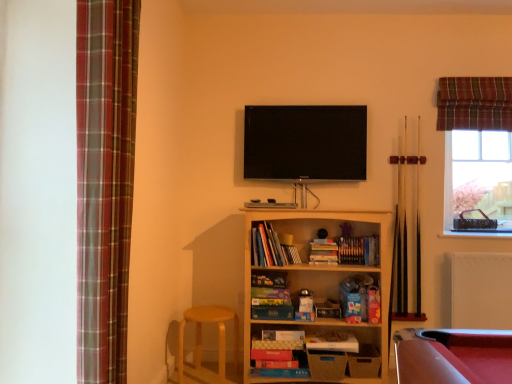
What is the approximate height of light brown wood stool at lower left?

It is 42.11 centimeters.

What do you see at coordinates (201, 343) in the screenshot? This screenshot has width=512, height=384. I see `light brown wood stool at lower left` at bounding box center [201, 343].

Measure the distance between point (456,307) and camera.

Point (456,307) and camera are 2.97 meters apart from each other.

What do you see at coordinates (402, 232) in the screenshot? The height and width of the screenshot is (384, 512). I see `brown wooden pool cue at right, marked as the first cue in a left-to-right arrangement` at bounding box center [402, 232].

How much space does matte cardboard book at center, which is counted as the first book, starting from the bottom, occupy horizontally?

It is 10.33 inches.

Where is `flat screen tv at upper center`? flat screen tv at upper center is located at coordinates (305, 142).

Locate an element on the screen. The image size is (512, 384). wooden bookshelf at center is located at coordinates (321, 281).

Consider the image. What's the angular difference between hardcover books at center, which ranks as the second book in top-to-bottom order, and plaid fabric curtain at upper right, which is the 1th curtain from right to left,'s facing directions?

The angular difference between hardcover books at center, which ranks as the second book in top-to-bottom order, and plaid fabric curtain at upper right, which is the 1th curtain from right to left, is 2.4 degrees.

Which object is closer to the camera, hardcover books at center, which ranks as the second book in top-to-bottom order, or plaid fabric curtain at upper right, which is the 1th curtain from right to left?

hardcover books at center, which ranks as the second book in top-to-bottom order.

Is hardcover books at center, placed as the second book when sorted from left to right, thinner than plaid fabric curtain at upper right, the first curtain viewed from the back?

Incorrect, the width of hardcover books at center, placed as the second book when sorted from left to right, is not less than that of plaid fabric curtain at upper right, the first curtain viewed from the back.

Based on the photo, could you tell me if hardcover books at center, marked as the second book in a bottom-to-top arrangement, is facing plaid fabric curtain at upper right, which is the 1th curtain from right to left?

No, hardcover books at center, marked as the second book in a bottom-to-top arrangement, is not oriented towards plaid fabric curtain at upper right, which is the 1th curtain from right to left.

Considering the points (123, 232) and (321, 156), which point is in front, point (123, 232) or point (321, 156)?

Point (123, 232)

Based on the photo, considering the sizes of objects plaid fabric curtain at left, the first curtain in the left-to-right sequence, and flat screen tv at upper center in the image provided, who is thinner, plaid fabric curtain at left, the first curtain in the left-to-right sequence, or flat screen tv at upper center?

Thinner between the two is flat screen tv at upper center.

What's the angular difference between plaid fabric curtain at left, the first curtain in the left-to-right sequence, and flat screen tv at upper center's facing directions?

The facing directions of plaid fabric curtain at left, the first curtain in the left-to-right sequence, and flat screen tv at upper center are 87.7 degrees apart.

Considering the sizes of objects plaid fabric curtain at left, the first curtain in the left-to-right sequence, and flat screen tv at upper center in the image provided, who is smaller, plaid fabric curtain at left, the first curtain in the left-to-right sequence, or flat screen tv at upper center?

With smaller size is flat screen tv at upper center.

Do you think clear glass window at upper right is within white matte radiator at lower right, or outside of it?

clear glass window at upper right cannot be found inside white matte radiator at lower right.

Is clear glass window at upper right taller than white matte radiator at lower right?

Yes, clear glass window at upper right is taller than white matte radiator at lower right.

Can you tell me how much clear glass window at upper right and white matte radiator at lower right differ in facing direction?

The angular difference between clear glass window at upper right and white matte radiator at lower right is 0.622 degrees.

Between clear glass window at upper right and white matte radiator at lower right, which one has smaller width?

With smaller width is clear glass window at upper right.

From the image's perspective, is wooden bookshelf at center under plaid fabric curtain at upper right, the 2th curtain in the left-to-right sequence?

Yes, from the image's perspective, wooden bookshelf at center is below plaid fabric curtain at upper right, the 2th curtain in the left-to-right sequence.

From a real-world perspective, which curtain is the 2nd one above the wooden bookshelf at center? Please provide its 2D coordinates.

[(474, 103)]

From a real-world perspective, which is physically above, wooden bookshelf at center or plaid fabric curtain at upper right, the 2th curtain in the left-to-right sequence?

plaid fabric curtain at upper right, the 2th curtain in the left-to-right sequence, is physically above.

Between point (384, 227) and point (503, 94), which one is positioned in front?

Positioned in front is point (384, 227).

Can you confirm if wooden pool cue at right, placed as the 1th cue when sorted from right to left, is bigger than brown wooden pool cue at right, marked as the first cue in a left-to-right arrangement?

Indeed, wooden pool cue at right, placed as the 1th cue when sorted from right to left, has a larger size compared to brown wooden pool cue at right, marked as the first cue in a left-to-right arrangement.

From a real-world perspective, is wooden pool cue at right, placed as the 1th cue when sorted from right to left, below brown wooden pool cue at right, marked as the first cue in a left-to-right arrangement?

Yes, from a real-world perspective, wooden pool cue at right, placed as the 1th cue when sorted from right to left, is below brown wooden pool cue at right, marked as the first cue in a left-to-right arrangement.

Is wooden pool cue at right, which is counted as the 2th cue, starting from the left, surrounding brown wooden pool cue at right, marked as the first cue in a left-to-right arrangement?

Definitely not — brown wooden pool cue at right, marked as the first cue in a left-to-right arrangement, is not inside wooden pool cue at right, which is counted as the 2th cue, starting from the left.

Is wooden pool cue at right, placed as the 1th cue when sorted from right to left, touching brown wooden pool cue at right, marked as the first cue in a left-to-right arrangement?

No.

Is plaid fabric curtain at upper right, the first curtain viewed from the back, facing towards clear glass window at upper right?

No, plaid fabric curtain at upper right, the first curtain viewed from the back, is not aimed at clear glass window at upper right.

From a real-world perspective, who is located higher, plaid fabric curtain at upper right, which is the 1th curtain from right to left, or clear glass window at upper right?

From a 3D spatial view, plaid fabric curtain at upper right, which is the 1th curtain from right to left, is above.

From the picture: How many degrees apart are the facing directions of plaid fabric curtain at upper right, the 2th curtain in the left-to-right sequence, and clear glass window at upper right?

There is a 0.708-degree angle between the facing directions of plaid fabric curtain at upper right, the 2th curtain in the left-to-right sequence, and clear glass window at upper right.

From the picture: Is there a large distance between plaid fabric curtain at upper right, the 2th curtain in the left-to-right sequence, and clear glass window at upper right?

No.

Identify the location of book that is the 1st object located above the wooden bookshelf at center (from the image's perspective). This screenshot has height=384, width=512. (323, 252).

Would you consider hardcover books at center, which appears as the second book when viewed from the right, to be distant from wooden bookshelf at center?

hardcover books at center, which appears as the second book when viewed from the right, is actually quite close to wooden bookshelf at center.

From the picture: How distant is hardcover books at center, marked as the second book in a bottom-to-top arrangement, from wooden bookshelf at center?

hardcover books at center, marked as the second book in a bottom-to-top arrangement, is 12.50 inches from wooden bookshelf at center.

Consider the image. Considering the sizes of objects hardcover books at center, which ranks as the second book in top-to-bottom order, and wooden bookshelf at center in the image provided, who is taller, hardcover books at center, which ranks as the second book in top-to-bottom order, or wooden bookshelf at center?

wooden bookshelf at center.

Locate an element on the screen. This screenshot has height=384, width=512. curtain on the right of hardcover books at center, placed as the second book when sorted from left to right is located at coordinates (474, 103).

Locate an element on the screen. curtain that appears on the left of flat screen tv at upper center is located at coordinates (105, 182).

Looking at the image, which one is located closer to brown wooden pool cue at right, arranged as the second cue when viewed from the right, hardcover books at center, the first book positioned from the top, or matte cardboard book at center, which is counted as the first book, starting from the bottom?

Among the two, matte cardboard book at center, which is counted as the first book, starting from the bottom, is located nearer to brown wooden pool cue at right, arranged as the second cue when viewed from the right.

Which object lies nearer to the anchor point light brown wood stool at lower left, wooden pool cue at right, which is counted as the 2th cue, starting from the left, or hardcover books at center, which ranks as the third book in bottom-to-top order?

Among the two, hardcover books at center, which ranks as the third book in bottom-to-top order, is located nearer to light brown wood stool at lower left.

Which object lies further to the anchor point hardcover books at center, marked as the 1th book in a left-to-right arrangement, white matte radiator at lower right or light brown wood stool at lower left?

The object further to hardcover books at center, marked as the 1th book in a left-to-right arrangement, is white matte radiator at lower right.

Considering their positions, is wooden bookshelf at center positioned closer to matte cardboard book at center, the third book when ordered from left to right, than light brown wood stool at lower left?

wooden bookshelf at center.

Which object lies nearer to the anchor point wooden pool cue at right, placed as the 1th cue when sorted from right to left, flat screen tv at upper center or white matte radiator at lower right?

The object closer to wooden pool cue at right, placed as the 1th cue when sorted from right to left, is white matte radiator at lower right.

When comparing their distances from wooden bookshelf at center, does hardcover books at center, marked as the 1th book in a left-to-right arrangement, or plaid fabric curtain at left, the second curtain viewed from the back, seem closer?

hardcover books at center, marked as the 1th book in a left-to-right arrangement, is positioned closer to the anchor wooden bookshelf at center.

When comparing their distances from flat screen tv at upper center, does light brown wood stool at lower left or hardcover books at center, placed as the second book when sorted from left to right, seem further?

The object further to flat screen tv at upper center is light brown wood stool at lower left.

Which object lies further to the anchor point clear glass window at upper right, plaid fabric curtain at left, the first curtain in the left-to-right sequence, or wooden bookshelf at center?

plaid fabric curtain at left, the first curtain in the left-to-right sequence, is positioned further to the anchor clear glass window at upper right.

Where is `shelf between light brown wood stool at lower left and wooden pool cue at right, placed as the 1th cue when sorted from right to left, in the horizontal direction`? The height and width of the screenshot is (384, 512). shelf between light brown wood stool at lower left and wooden pool cue at right, placed as the 1th cue when sorted from right to left, in the horizontal direction is located at coordinates (321, 281).

Locate an element on the screen. This screenshot has width=512, height=384. cue between plaid fabric curtain at upper right, marked as the second curtain in a front-to-back arrangement, and wooden pool cue at right, which is counted as the 2th cue, starting from the left, in the vertical direction is located at coordinates (402, 232).

Where is `shelf between hardcover books at center, which ranks as the third book in bottom-to-top order, and clear glass window at upper right from left to right`? shelf between hardcover books at center, which ranks as the third book in bottom-to-top order, and clear glass window at upper right from left to right is located at coordinates (321, 281).

Identify the location of curtain between light brown wood stool at lower left and clear glass window at upper right from left to right. Image resolution: width=512 pixels, height=384 pixels. (474, 103).